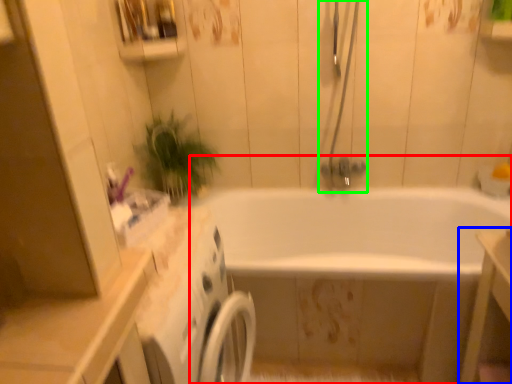
Question: Which object is the farthest from bathtub (highlighted by a red box)? Choose among these: vanity (highlighted by a blue box) or shower door (highlighted by a green box).

Choices:
 (A) vanity
 (B) shower door

Answer: (A)